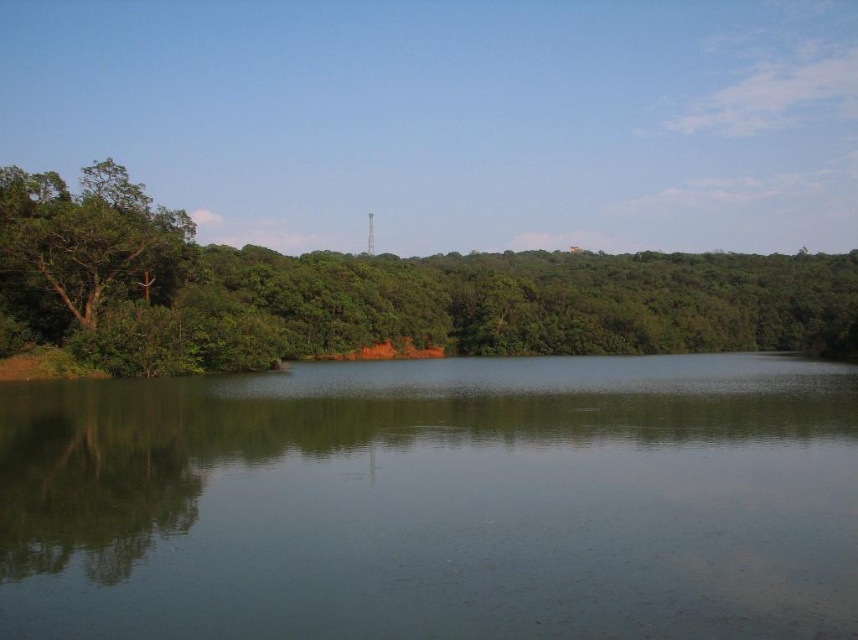
Question: Which point appears closest to the camera in this image?

Choices:
 (A) (107, 234)
 (B) (711, 609)
 (C) (363, 264)

Answer: (B)

Question: Which point is closer to the camera?

Choices:
 (A) green leafy tree at left
 (B) green smooth water at center
 (C) green matte tree at left

Answer: (B)

Question: From the image, what is the correct spatial relationship of green leafy tree at left in relation to green matte tree at left?

Choices:
 (A) below
 (B) above

Answer: (A)

Question: Where is green smooth water at center located in relation to green leafy tree at left in the image?

Choices:
 (A) above
 (B) below

Answer: (B)

Question: Which of the following is the closest to the observer?

Choices:
 (A) green smooth water at center
 (B) green matte tree at left

Answer: (A)

Question: Can you confirm if green smooth water at center is smaller than green leafy tree at left?

Choices:
 (A) yes
 (B) no

Answer: (A)